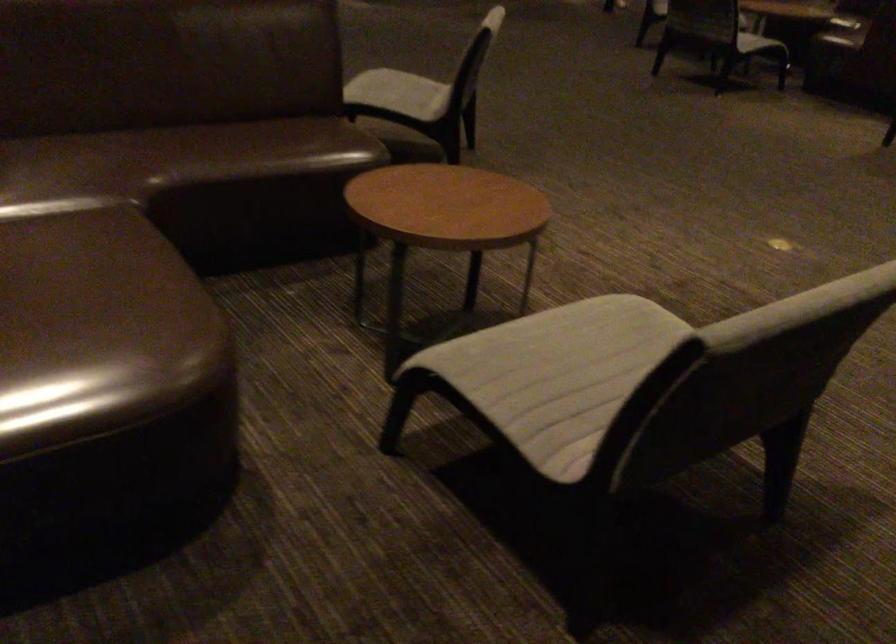
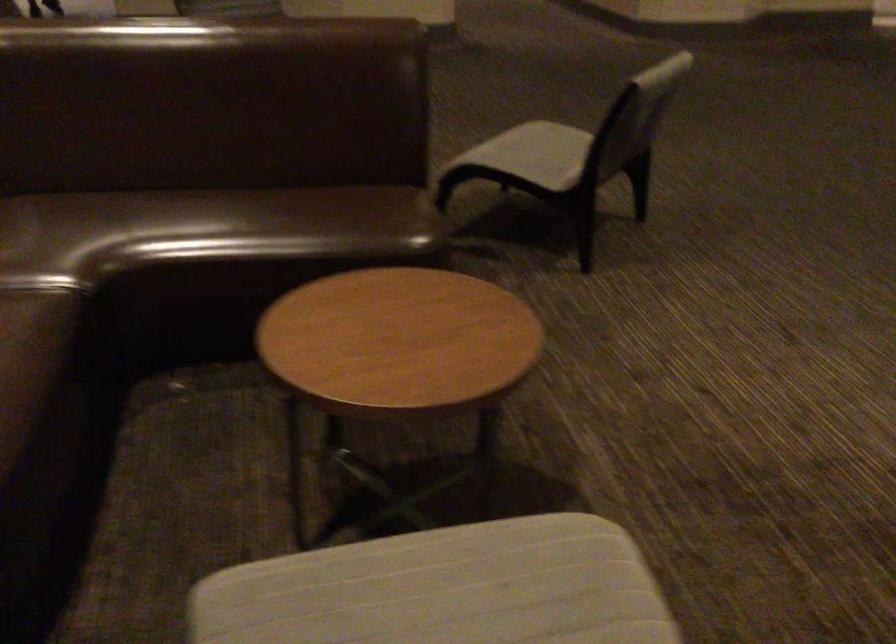
The point at (403, 90) is marked in the first image. Where is the corresponding point in the second image?

(533, 154)